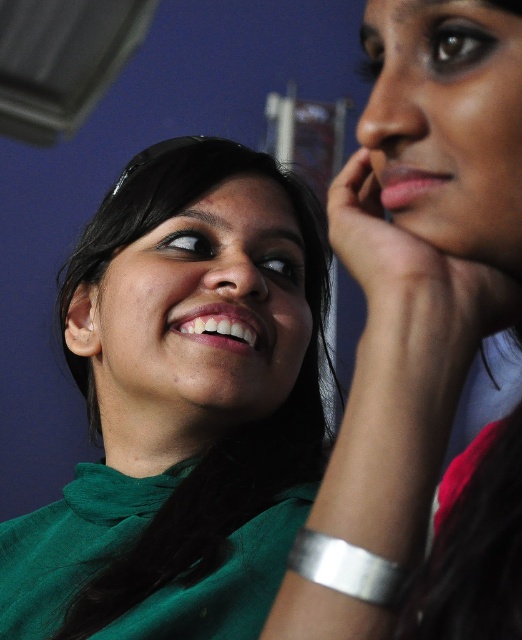
Question: Does matte green face at center appear on the right side of matte skin face at upper right?

Choices:
 (A) no
 (B) yes

Answer: (A)

Question: Which point appears closest to the camera in this image?

Choices:
 (A) (272, 413)
 (B) (108, 296)

Answer: (B)

Question: Which is farther from the matte green face at center?

Choices:
 (A) matte skin face at upper right
 (B) green matte shirt at center
 (C) matte green shirt at upper left

Answer: (A)

Question: Does green matte shirt at center have a larger size compared to matte green face at center?

Choices:
 (A) yes
 (B) no

Answer: (A)

Question: Which object appears closest to the camera in this image?

Choices:
 (A) matte green face at center
 (B) matte green shirt at upper left
 (C) green matte shirt at center

Answer: (B)

Question: Does matte green shirt at upper left have a larger size compared to matte skin face at upper right?

Choices:
 (A) no
 (B) yes

Answer: (B)